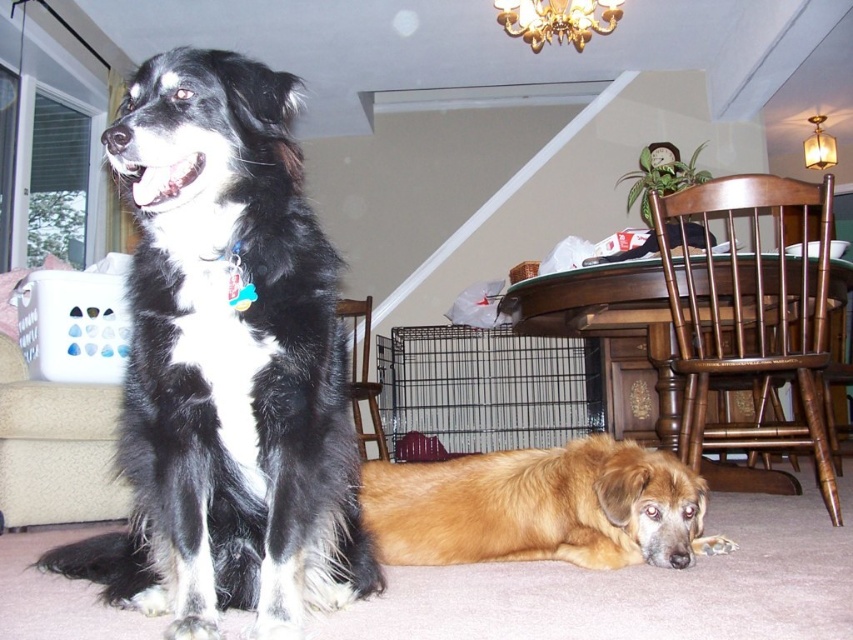
You are a pet sitter who needs to place a 60 cm wide feeding mat between the black fur dog at left and the golden fur dog at lower center. Is there enough space between them to fit the mat?

The black fur dog at left is 52.60 centimeters from golden fur dog at lower center. Since the distance between them is less than 60 cm, the feeding mat will not fit.